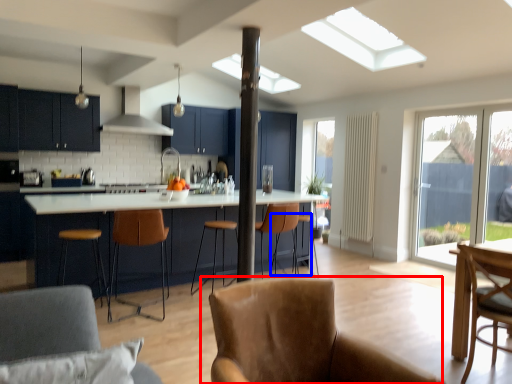
Question: Among these objects, which one is nearest to the camera, chair (highlighted by a red box) or bar stool (highlighted by a blue box)?

Choices:
 (A) chair
 (B) bar stool

Answer: (A)